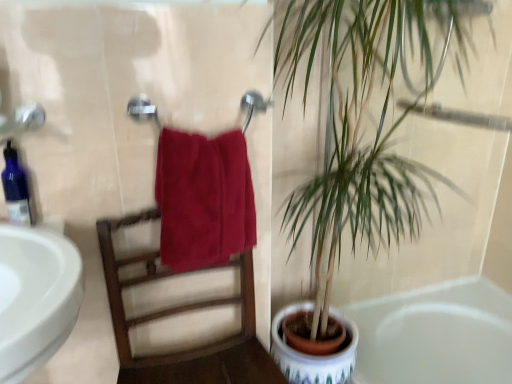
The width and height of the screenshot is (512, 384). What do you see at coordinates (183, 312) in the screenshot?
I see `wooden chair at center` at bounding box center [183, 312].

The height and width of the screenshot is (384, 512). Describe the element at coordinates (203, 199) in the screenshot. I see `satin red towel at center` at that location.

At what (x,y) coordinates should I click in order to perform the action: click on matte metal towel bar at center. Please return your answer as a coordinate pair (x, y). Looking at the image, I should click on (142, 110).

Measure the distance between point (x=437, y=337) and camera.

5.43 feet.

You are a GUI agent. You are given a task and a screenshot of the screen. Output one action in this format:
    pyautogui.click(x=<x>, y=<y>)
    Task: Click on the green leafy plant at right
    Image resolution: width=512 pixels, height=384 pixels.
    Given the screenshot: What is the action you would take?
    pyautogui.click(x=362, y=120)

Image resolution: width=512 pixels, height=384 pixels. Describe the element at coordinates (15, 188) in the screenshot. I see `blue glass soap dispenser at left` at that location.

Locate an element on the screen. This screenshot has width=512, height=384. wooden chair at center is located at coordinates (183, 312).

Can matte metal towel bar at center be found inside white glossy bathtub at lower right?

No.

Locate an element on the screen. The width and height of the screenshot is (512, 384). bathtub beneath the matte metal towel bar at center (from a real-world perspective) is located at coordinates (436, 335).

Considering the sizes of white glossy bathtub at lower right and matte metal towel bar at center in the image, is white glossy bathtub at lower right taller or shorter than matte metal towel bar at center?

In the image, white glossy bathtub at lower right appears to be shorter than matte metal towel bar at center.

What's the angular difference between white glossy bathtub at lower right and matte metal towel bar at center's facing directions?

They differ by 88.9 degrees in their facing directions.

Image resolution: width=512 pixels, height=384 pixels. In order to click on chair located below the green leafy plant at right (from the image's perspective) in this screenshot , I will do `click(183, 312)`.

Looking at their sizes, would you say green leafy plant at right is wider or thinner than wooden chair at center?

Considering their sizes, green leafy plant at right looks broader than wooden chair at center.

Could you tell me if green leafy plant at right is turned towards wooden chair at center?

No, green leafy plant at right is not oriented towards wooden chair at center.

Which of these two, wooden chair at center or satin red towel at center, stands shorter?

With less height is satin red towel at center.

How many degrees apart are the facing directions of wooden chair at center and satin red towel at center?

wooden chair at center and satin red towel at center are facing 0.000619 degrees away from each other.

Are wooden chair at center and satin red towel at center located far from each other?

→ No, wooden chair at center is not far away from satin red towel at center.

In the scene shown: Between wooden chair at center and satin red towel at center, which one appears on the right side from the viewer's perspective?

Positioned to the right is satin red towel at center.

Which point is more distant from viewer, (401, 314) or (195, 202)?

The point (401, 314) is farther from the camera.

Considering the positions of objects white glossy bathtub at lower right and satin red towel at center in the image provided, who is more to the left, white glossy bathtub at lower right or satin red towel at center?

satin red towel at center is more to the left.

From a real-world perspective, who is located lower, white glossy bathtub at lower right or satin red towel at center?

white glossy bathtub at lower right is physically lower.

Is white glossy bathtub at lower right facing towards satin red towel at center?

No, white glossy bathtub at lower right does not turn towards satin red towel at center.

Looking at this image, in terms of height, does blue glass soap dispenser at left look taller or shorter compared to white glossy bathtub at lower right?

In the image, blue glass soap dispenser at left appears to be taller than white glossy bathtub at lower right.

Locate an element on the screen. The width and height of the screenshot is (512, 384). soap dispenser above the white glossy bathtub at lower right (from the image's perspective) is located at coordinates (15, 188).

Can you confirm if blue glass soap dispenser at left is wider than white glossy bathtub at lower right?

No, blue glass soap dispenser at left is not wider than white glossy bathtub at lower right.

Is white glossy bathtub at lower right inside blue glass soap dispenser at left?

No, white glossy bathtub at lower right is not inside blue glass soap dispenser at left.

Locate an element on the screen. houseplant in front of the satin red towel at center is located at coordinates (362, 120).

From a real-world perspective, is satin red towel at center located beneath green leafy plant at right?

No, from a real-world perspective, satin red towel at center is not under green leafy plant at right.

Considering the relative sizes of satin red towel at center and green leafy plant at right in the image provided, is satin red towel at center bigger than green leafy plant at right?

Actually, satin red towel at center might be smaller than green leafy plant at right.

How far apart are satin red towel at center and green leafy plant at right?

satin red towel at center is 35.18 centimeters away from green leafy plant at right.

You are a GUI agent. You are given a task and a screenshot of the screen. Output one action in this format:
    pyautogui.click(x=<x>, y=<y>)
    Task: Click on the houseplant lying above the white glossy bathtub at lower right (from the image's perspective)
    
    Given the screenshot: What is the action you would take?
    pyautogui.click(x=362, y=120)

Is white glossy bathtub at lower right touching green leafy plant at right?

white glossy bathtub at lower right and green leafy plant at right are not in contact.

Does white glossy bathtub at lower right have a smaller size compared to green leafy plant at right?

Yes.

Find the location of a particular element. Image resolution: width=512 pixels, height=384 pixels. towel bar in front of the white glossy bathtub at lower right is located at coordinates (142, 110).

There is a wooden chair at center. Where is `houseplant above it (from a real-world perspective)`? Image resolution: width=512 pixels, height=384 pixels. houseplant above it (from a real-world perspective) is located at coordinates 362,120.

Based on the photo, based on their spatial positions, is green leafy plant at right or blue glass soap dispenser at left closer to matte metal towel bar at center?

Based on the image, green leafy plant at right appears to be nearer to matte metal towel bar at center.

From the image, which object appears to be farther from satin red towel at center, blue glass soap dispenser at left or green leafy plant at right?

Among the two, blue glass soap dispenser at left is located further to satin red towel at center.

Which object lies further to the anchor point white glossy bathtub at lower right, satin red towel at center or matte metal towel bar at center?

matte metal towel bar at center is further to white glossy bathtub at lower right.

Based on their spatial positions, is wooden chair at center or satin red towel at center further from white glossy bathtub at lower right?

satin red towel at center is positioned further to the anchor white glossy bathtub at lower right.

Consider the image. Considering their positions, is wooden chair at center positioned closer to matte metal towel bar at center than satin red towel at center?

The object closer to matte metal towel bar at center is satin red towel at center.

From the image, which object appears to be nearer to blue glass soap dispenser at left, satin red towel at center or white glossy bathtub at lower right?

satin red towel at center.

Considering their positions, is blue glass soap dispenser at left positioned closer to satin red towel at center than wooden chair at center?

Based on the image, wooden chair at center appears to be nearer to satin red towel at center.

Looking at the image, which one is located further to satin red towel at center, wooden chair at center or green leafy plant at right?

green leafy plant at right.

At what (x,y) coordinates should I click in order to perform the action: click on towel/napkin between matte metal towel bar at center and wooden chair at center vertically. Please return your answer as a coordinate pair (x, y). This screenshot has width=512, height=384. Looking at the image, I should click on (203, 199).

Where is `houseplant between satin red towel at center and white glossy bathtub at lower right in the horizontal direction`? houseplant between satin red towel at center and white glossy bathtub at lower right in the horizontal direction is located at coordinates (362, 120).

Where is `towel/napkin situated between matte metal towel bar at center and white glossy bathtub at lower right from left to right`? The image size is (512, 384). towel/napkin situated between matte metal towel bar at center and white glossy bathtub at lower right from left to right is located at coordinates (203, 199).

I want to click on chair between blue glass soap dispenser at left and green leafy plant at right in the horizontal direction, so click(x=183, y=312).